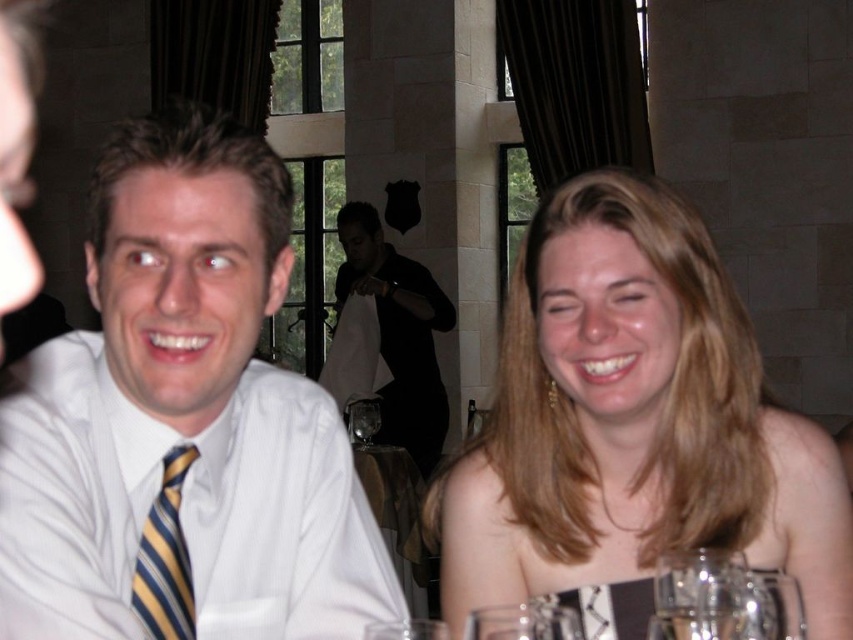
Between blonde hair at upper right and transparent glass at center, which one is positioned higher?

Positioned higher is blonde hair at upper right.

From the picture: Does blonde hair at upper right have a smaller size compared to transparent glass at center?

No.

In order to click on blonde hair at upper right in this screenshot , I will do `click(631, 424)`.

Can you confirm if white striped tie at left is positioned to the right of yellow striped tie at left?

Indeed, white striped tie at left is positioned on the right side of yellow striped tie at left.

Does white striped tie at left appear under yellow striped tie at left?

Actually, white striped tie at left is above yellow striped tie at left.

Between point (135, 460) and point (183, 454), which one is positioned in front?

Positioned in front is point (135, 460).

Identify the location of white striped tie at left. This screenshot has height=640, width=853. (183, 417).

Consider the image. Between white striped tie at left and black matte shirt at center, which one has less height?

white striped tie at left

In the scene shown: Is white striped tie at left thinner than black matte shirt at center?

Yes, white striped tie at left is thinner than black matte shirt at center.

Find the location of a particular element. white striped tie at left is located at coordinates (183, 417).